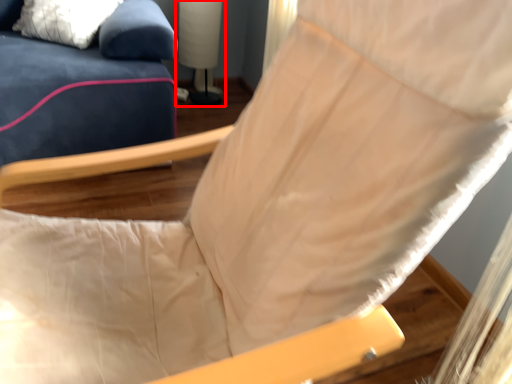
Question: From the image, what is the correct spatial relationship of table lamp (annotated by the red box) in relation to pillow?

Choices:
 (A) left
 (B) right

Answer: (B)